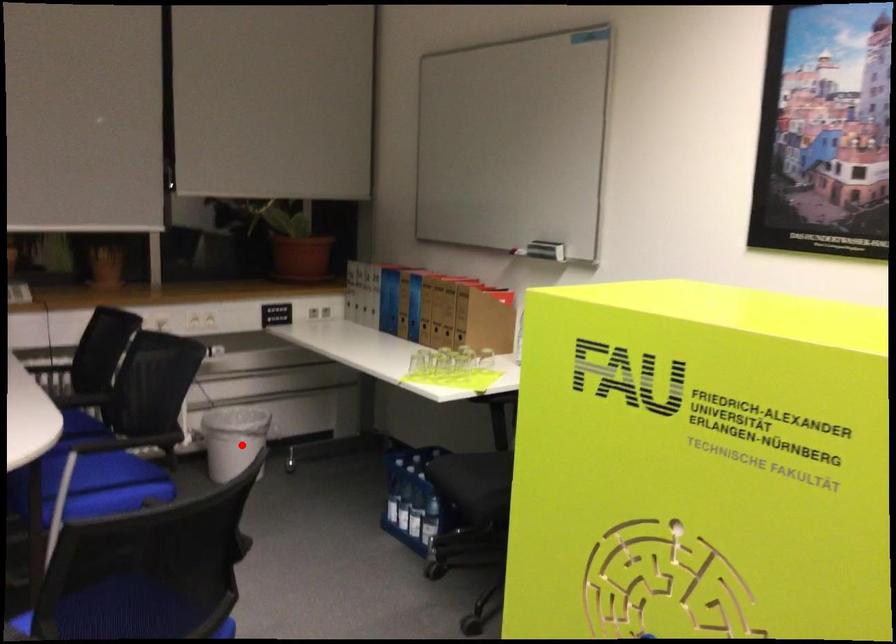
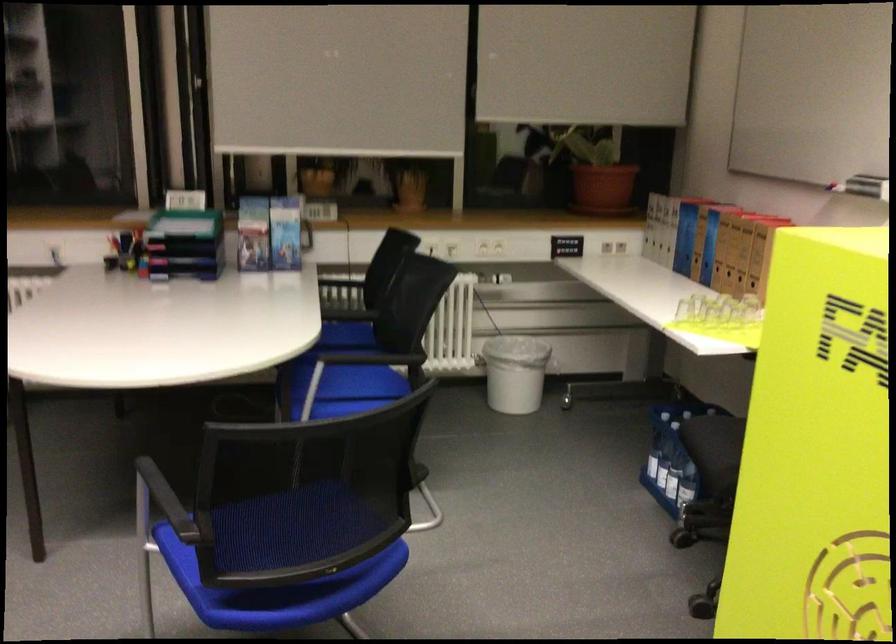
Find the pixel in the second image that matches the highlighted location in the first image.

(514, 373)